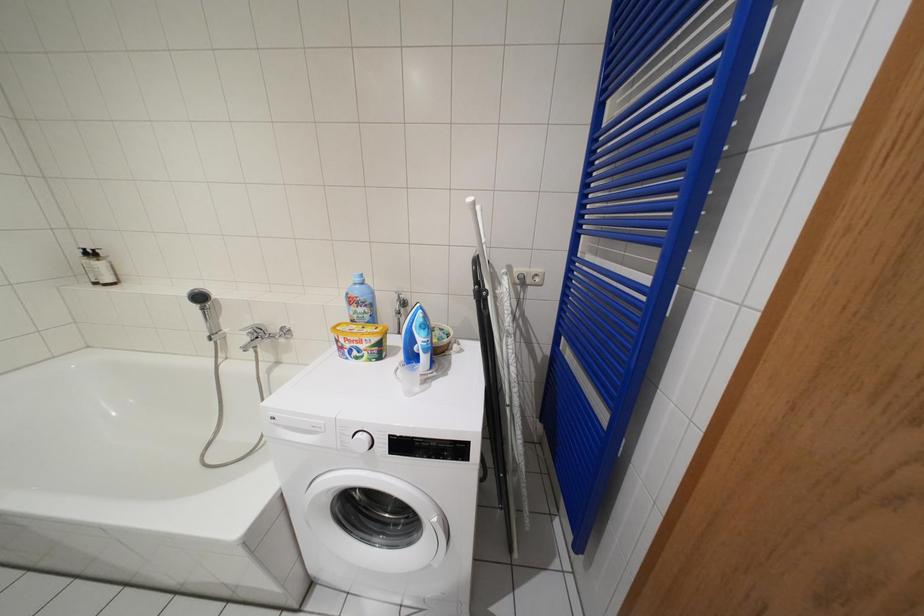
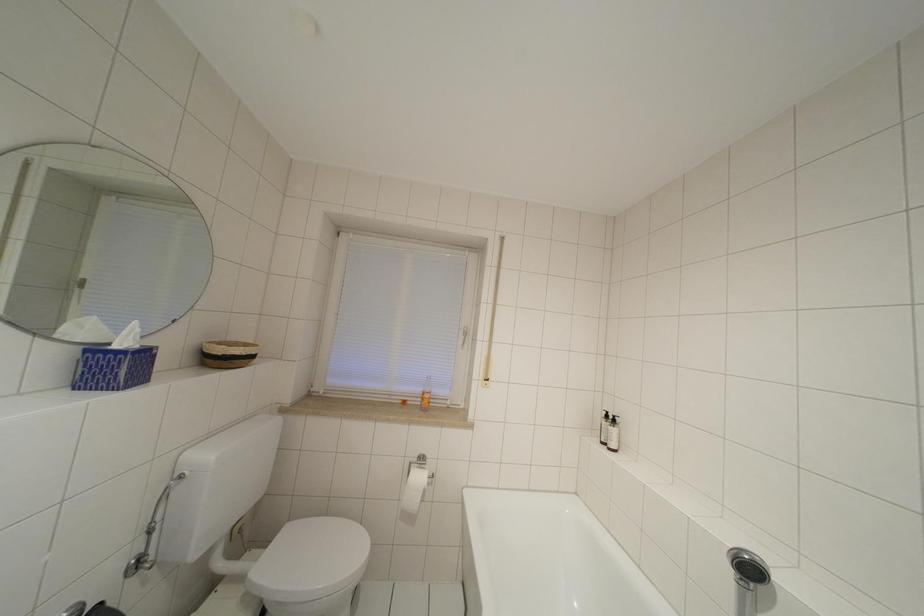
Question: The first image is from the beginning of the video and the second image is from the end. How did the camera likely rotate when shooting the video?

Choices:
 (A) Left
 (B) Right
 (C) Up
 (D) Down

Answer: (A)